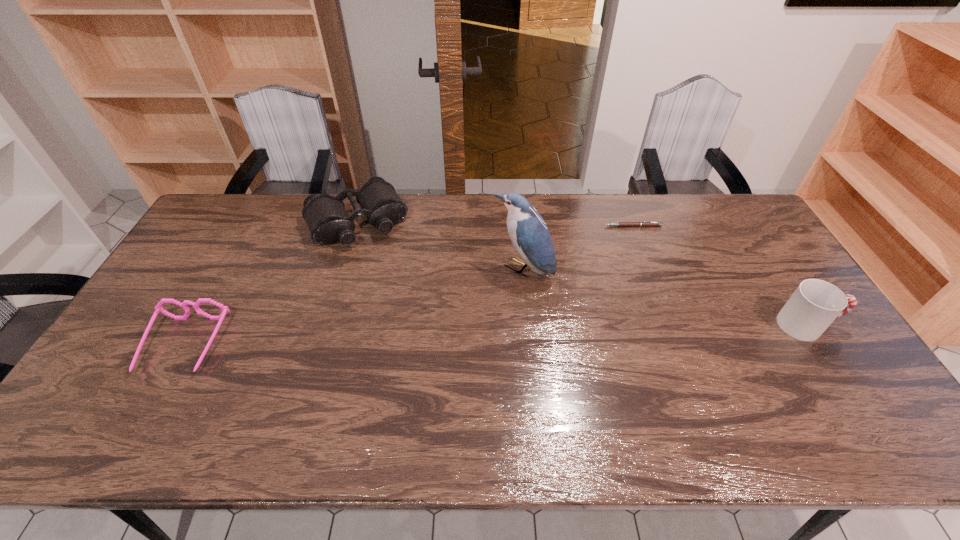
Locate an element on the screen. The image size is (960, 540). free space on the desktop that is between the second shortest object and the rightmost object and is positioned at the tip of the tallest object's beak is located at coordinates (459, 336).

Identify the location of vacant space on the desktop that is between the fourth tallest object and the rightmost object and is positioned at the nib of the fourth object from left to right. Image resolution: width=960 pixels, height=540 pixels. (567, 333).

I want to click on vacant spot on the desktop that is between the leftmost object and the rightmost object and is positioned through the eyepieces of the binoculars, so click(420, 338).